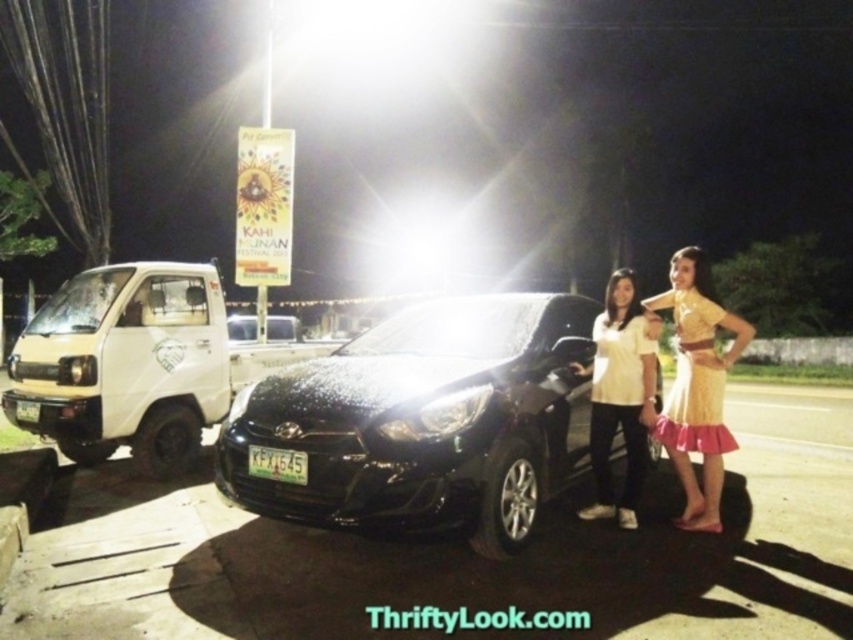
Question: Does black glossy car at center have a smaller size compared to white matte shirt at center?

Choices:
 (A) no
 (B) yes

Answer: (A)

Question: Which point is closer to the camera?

Choices:
 (A) (436, 472)
 (B) (631, 355)
 (C) (711, 355)

Answer: (A)

Question: Can you confirm if black glossy car at center is thinner than yellow satin dress at right?

Choices:
 (A) yes
 (B) no

Answer: (B)

Question: Which of these objects is positioned farthest from the yellow satin dress at right?

Choices:
 (A) black glossy car at center
 (B) white matte shirt at center

Answer: (A)

Question: Which of the following is the closest to the observer?

Choices:
 (A) (698, 358)
 (B) (628, 387)
 (C) (514, 456)

Answer: (C)

Question: Does black glossy car at center lie in front of white matte shirt at center?

Choices:
 (A) no
 (B) yes

Answer: (B)